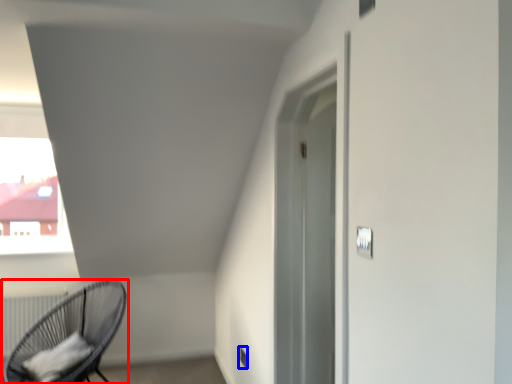
Question: Which object is further to the camera taking this photo, chair (highlighted by a red box) or electric outlet (highlighted by a blue box)?

Choices:
 (A) chair
 (B) electric outlet

Answer: (B)